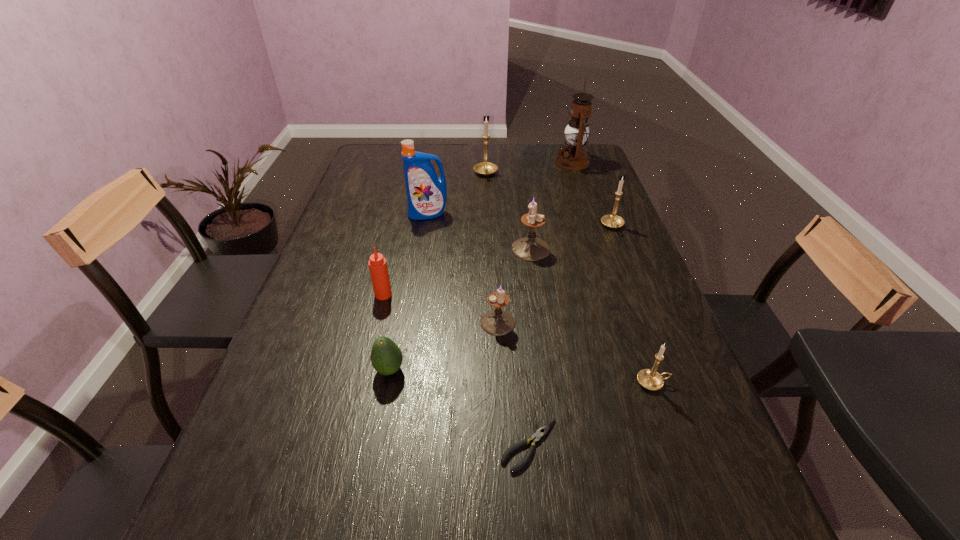
Identify the location of vacant space that's between the right purple candle holder and the farthest candle holder. The image size is (960, 540). (509, 212).

Where is `vacant space in between the second farthest gold candle holder and the leftmost gold candle holder`? This screenshot has width=960, height=540. vacant space in between the second farthest gold candle holder and the leftmost gold candle holder is located at coordinates (549, 200).

Find the location of `free space between the second tallest object and the lantern`. free space between the second tallest object and the lantern is located at coordinates (500, 188).

This screenshot has width=960, height=540. I want to click on vacant area between the nearer purple candle holder and the fifth nearest object, so (441, 308).

Identify the location of vacant region between the nearer purple candle holder and the nearest gold candle holder. The height and width of the screenshot is (540, 960). (575, 353).

Image resolution: width=960 pixels, height=540 pixels. What are the coordinates of `unoccupied position between the farthest gold candle holder and the lantern` in the screenshot? It's located at (529, 168).

Identify which object is located as the third nearest to the detergent. Please provide its 2D coordinates. Your answer should be formatted as a tuple, i.e. [(x, y)], where the tuple contains the x and y coordinates of a point satisfying the conditions above.

[(377, 264)]

Image resolution: width=960 pixels, height=540 pixels. Identify the location of object that can be found as the sixth closest to the nearest object. (612, 221).

Locate which candle holder ranks second in proximity to the tallest object. Please provide its 2D coordinates. Your answer should be formatted as a tuple, i.e. [(x, y)], where the tuple contains the x and y coordinates of a point satisfying the conditions above.

[(612, 221)]

At what (x,y) coordinates should I click in order to perform the action: click on candle holder that is the fourth closest to the nearest gold candle holder. Please return your answer as a coordinate pair (x, y). Looking at the image, I should click on (485, 168).